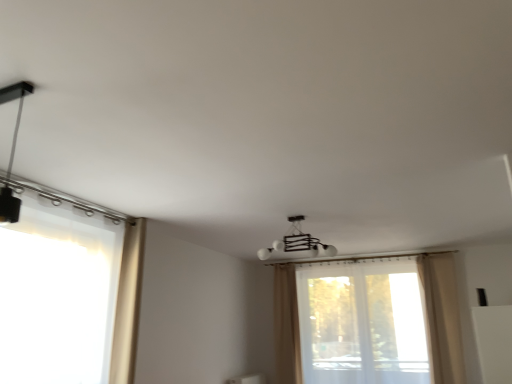
Question: Is beige fabric curtain at right, positioned as the 1th curtain in right-to-left order, facing towards translucent fabric window at left, placed as the 1th window when sorted from front to back?

Choices:
 (A) no
 (B) yes

Answer: (A)

Question: Is beige fabric curtain at right, placed as the 2th curtain when sorted from front to back, not close to translucent fabric window at left, placed as the second window when sorted from right to left?

Choices:
 (A) yes
 (B) no

Answer: (A)

Question: Is beige fabric curtain at right, positioned as the 1th curtain in right-to-left order, at the right side of translucent fabric window at left, placed as the second window when sorted from right to left?

Choices:
 (A) yes
 (B) no

Answer: (A)

Question: Can you confirm if beige fabric curtain at right, marked as the third curtain in a left-to-right arrangement, is taller than translucent fabric window at left, placed as the second window when sorted from right to left?

Choices:
 (A) yes
 (B) no

Answer: (A)

Question: Is translucent fabric window at left, placed as the second window when sorted from right to left, inside beige fabric curtain at right, placed as the 2th curtain when sorted from front to back?

Choices:
 (A) yes
 (B) no

Answer: (B)

Question: From the image's perspective, would you say beige fabric curtain at right, marked as the third curtain in a left-to-right arrangement, is shown under translucent fabric window at left, placed as the 1th window when sorted from front to back?

Choices:
 (A) yes
 (B) no

Answer: (A)

Question: Does transparent fabric window at center, positioned as the 1th window in back-to-front order, lie in front of translucent fabric window at left, placed as the 1th window when sorted from front to back?

Choices:
 (A) yes
 (B) no

Answer: (B)

Question: Considering the relative sizes of transparent fabric window at center, the first window viewed from the right, and translucent fabric window at left, placed as the 1th window when sorted from front to back, in the image provided, is transparent fabric window at center, the first window viewed from the right, taller than translucent fabric window at left, placed as the 1th window when sorted from front to back,?

Choices:
 (A) yes
 (B) no

Answer: (A)

Question: Could you tell me if transparent fabric window at center, positioned as the 1th window in back-to-front order, is facing translucent fabric window at left, placed as the 2th window when sorted from back to front?

Choices:
 (A) no
 (B) yes

Answer: (B)

Question: Is transparent fabric window at center, the first window viewed from the right, not inside translucent fabric window at left, placed as the 1th window when sorted from left to right?

Choices:
 (A) yes
 (B) no

Answer: (A)

Question: From the image's perspective, is transparent fabric window at center, which appears as the 2th window when viewed from the left, below translucent fabric window at left, placed as the second window when sorted from right to left?

Choices:
 (A) no
 (B) yes

Answer: (B)

Question: Considering the relative sizes of transparent fabric window at center, which appears as the 2th window when viewed from the left, and translucent fabric window at left, placed as the 2th window when sorted from back to front, in the image provided, is transparent fabric window at center, which appears as the 2th window when viewed from the left, smaller than translucent fabric window at left, placed as the 2th window when sorted from back to front,?

Choices:
 (A) no
 (B) yes

Answer: (A)

Question: Considering the relative sizes of white glossy chandelier at center, the 2th lamp viewed from the top, and translucent fabric window at left, placed as the 1th window when sorted from left to right, in the image provided, is white glossy chandelier at center, the 2th lamp viewed from the top, bigger than translucent fabric window at left, placed as the 1th window when sorted from left to right,?

Choices:
 (A) no
 (B) yes

Answer: (A)